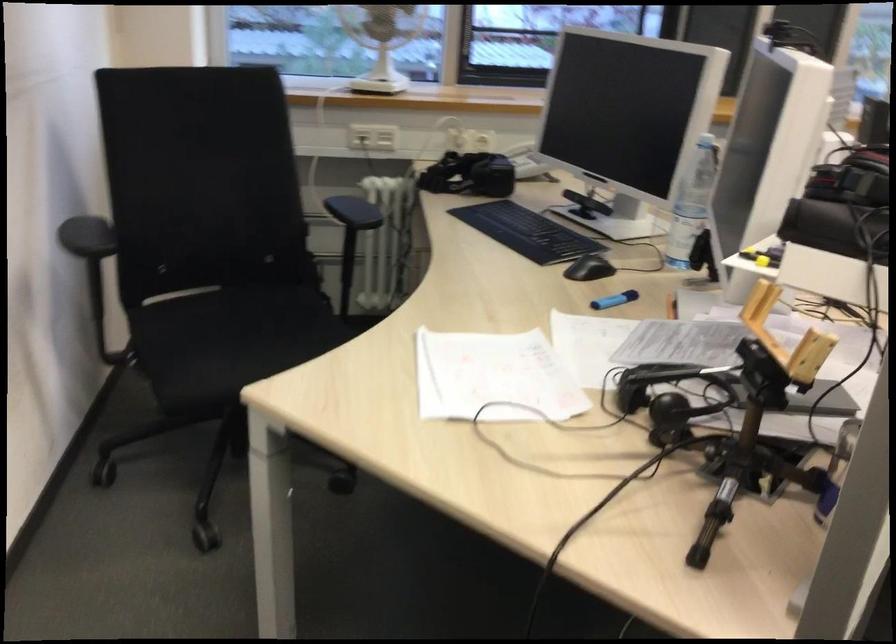
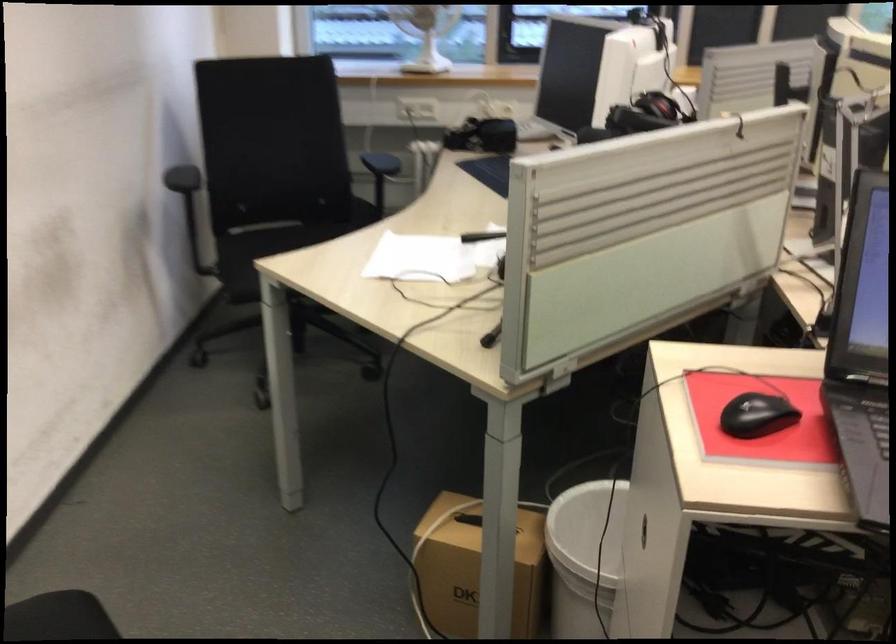
In the second image, find the point that corresponds to (x=202, y=334) in the first image.

(263, 252)